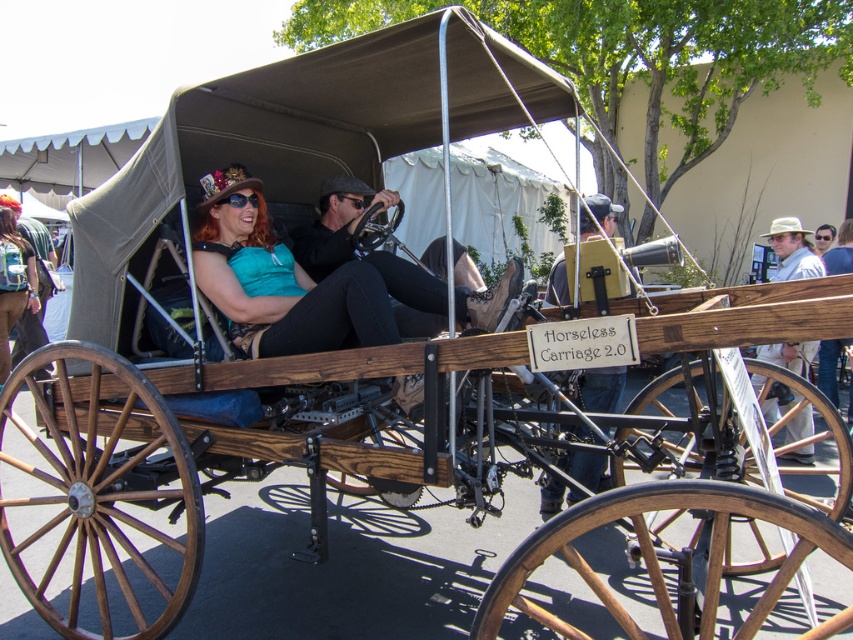
You are a delivery person needing to place a small package in the Horseless Carriage 2.0. The package is 10 cm in width. The light brown straw hat at upper right and the matte black backpack at left are already inside. Which object can the package fit into?

The light brown straw hat at upper right is smaller than the matte black backpack at left. Since the package is 10 cm wide, it can fit into the matte black backpack at left, which is larger.

You are standing 4 meters away from the Horseless Carriage 2.0. You want to read the wooden signboard at center attached to its side. Can you reach it by taking one step forward?

The wooden signboard at center is 3.79 meters away from the viewer. Since you are currently 4 meters away, taking one step forward would reduce the distance, but unless the step covers at least 0.21 meters, you might still need to move closer. However, the exact step length isn

You are a passenger in the Horseless Carriage 2.0 and need to place your matte black backpack at left on the floor. Considering the space between the matte black leather steering wheel at center and the seat, will the backpack fit comfortably?

The matte black leather steering wheel at center is larger than the matte black backpack at left, so there should be enough space for the backpack to fit comfortably between them.